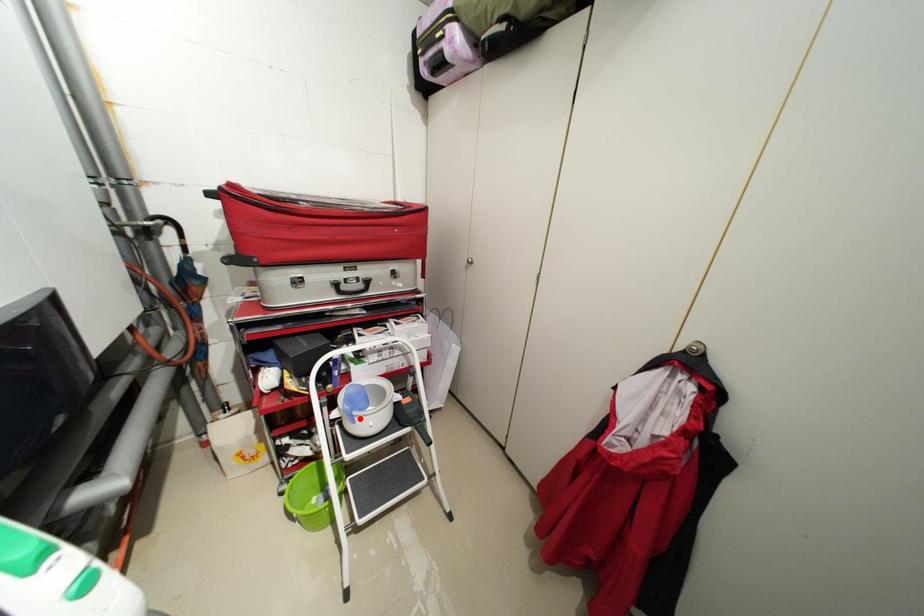
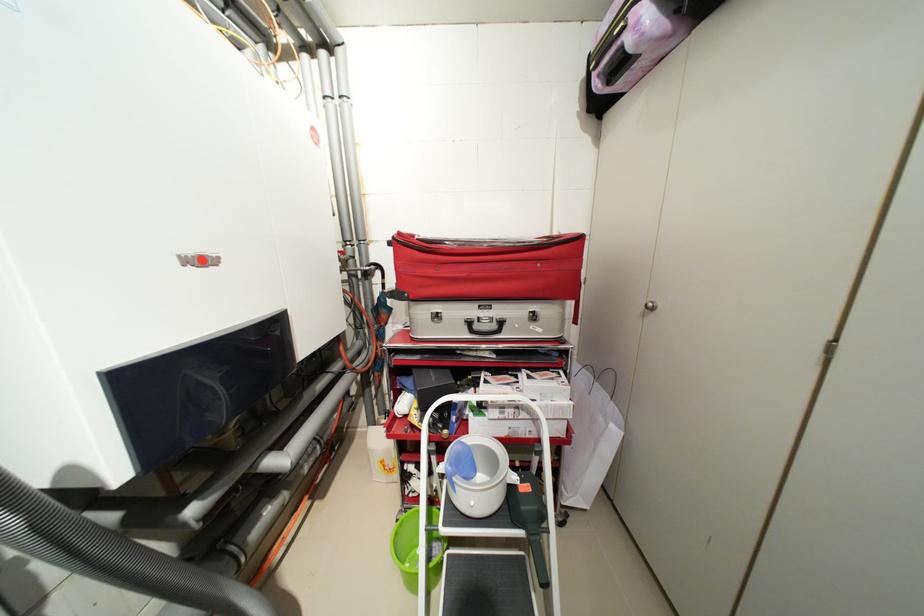
Find the pixel in the second image that matches the highlighted location in the first image.

(459, 485)